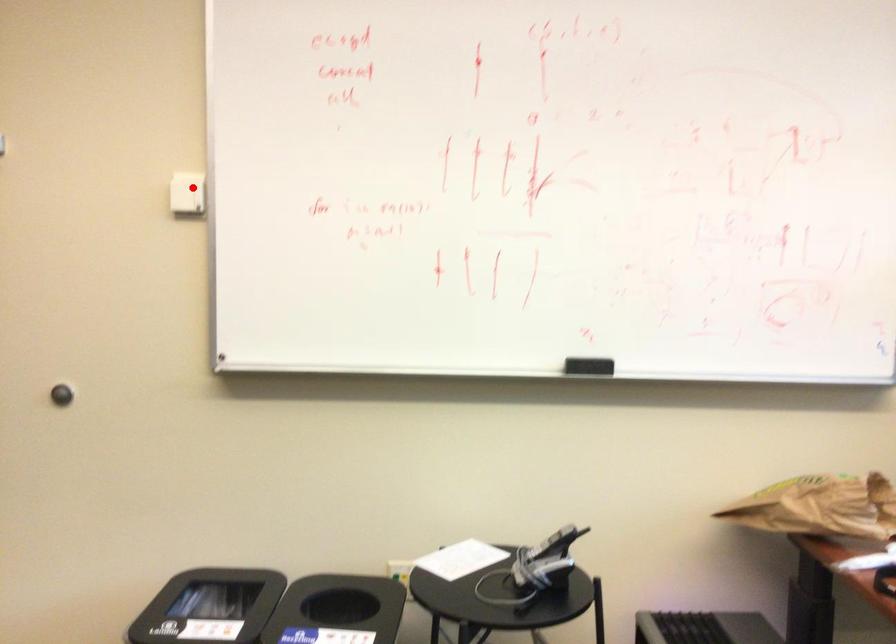
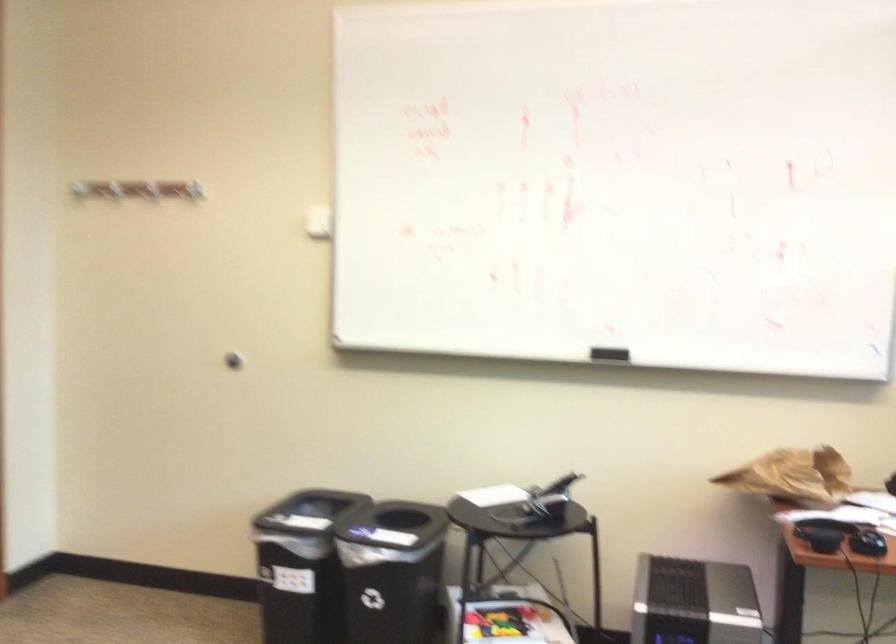
The point at the highlighted location is marked in the first image. Where is the corresponding point in the second image?

(317, 222)